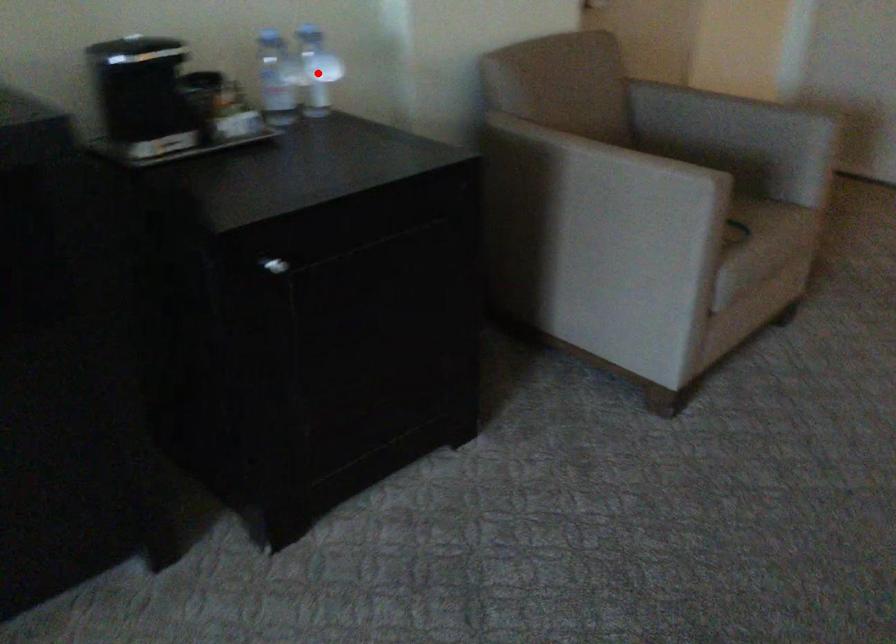
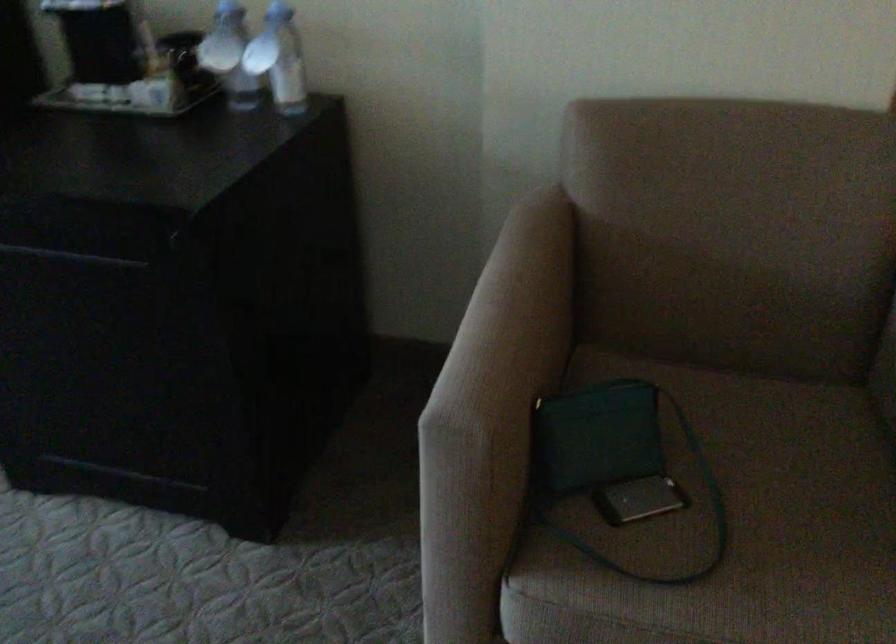
In the second image, find the point that corresponds to the highlighted location in the first image.

(279, 59)